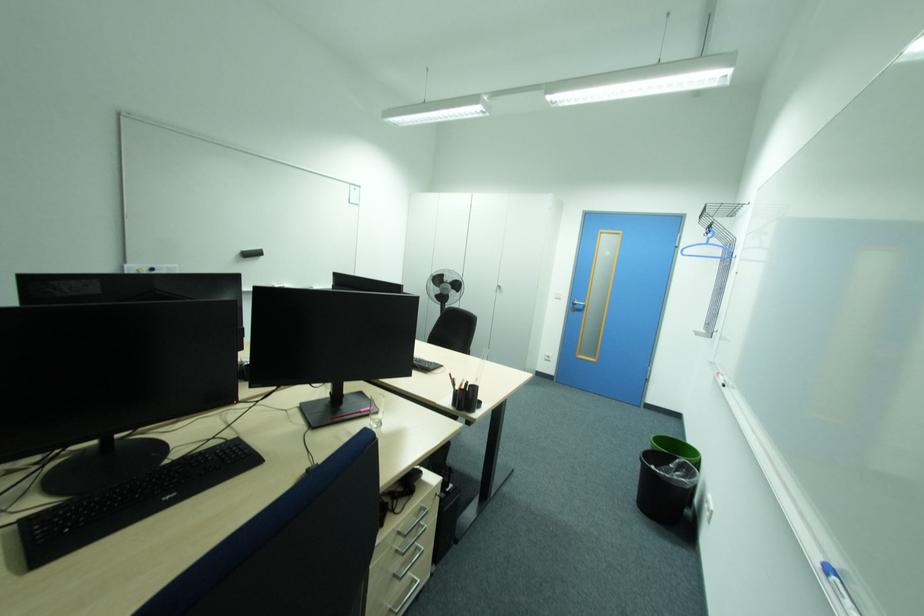
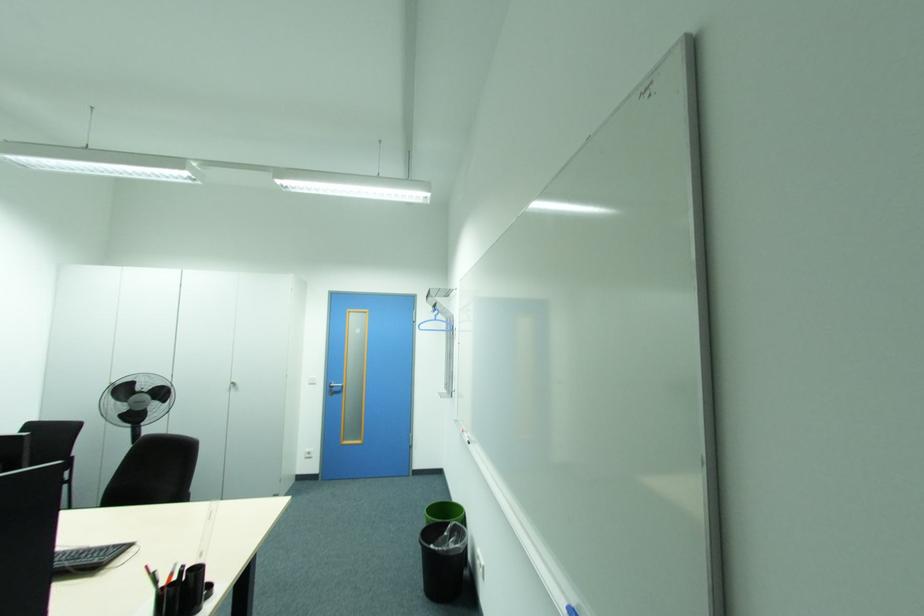
Question: The images are taken continuously from a first-person perspective. In which direction is your viewpoint rotating?

Choices:
 (A) Left
 (B) Right
 (C) Up
 (D) Down

Answer: (B)